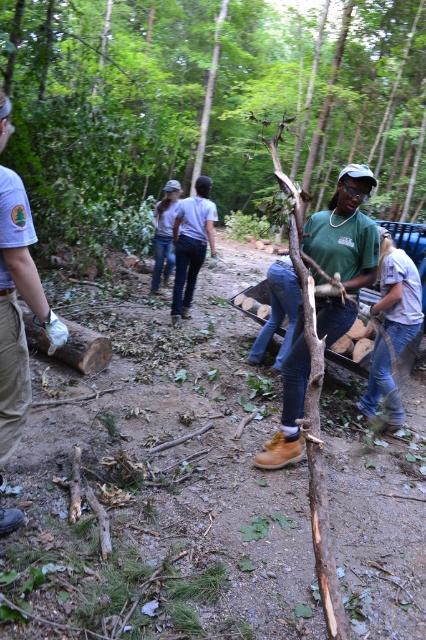
Does brown leather boots at center appear over brushed khaki pants at left?

Incorrect, brown leather boots at center is not positioned above brushed khaki pants at left.

Find the location of a particular element. Image resolution: width=426 pixels, height=640 pixels. brown leather boots at center is located at coordinates (345, 232).

The image size is (426, 640). I want to click on brown leather boots at center, so (345, 232).

Image resolution: width=426 pixels, height=640 pixels. Find the location of `brown leather boots at center`. brown leather boots at center is located at coordinates (345, 232).

Measure the distance from brown rough wood at center to brushed khaki pants at left.

84.74 feet

Is point (255, 196) farther from camera compared to point (2, 237)?

That is True.

Where is `brown rough wood at center`? brown rough wood at center is located at coordinates click(x=204, y=106).

Can you confirm if light blue jeans at center is thinner than white cotton shirt at center?

Correct, light blue jeans at center's width is less than white cotton shirt at center's.

Who is more distant from viewer, (x=178, y=300) or (x=158, y=225)?

The point (x=158, y=225) is behind.

Identify the location of light blue jeans at center. (192, 243).